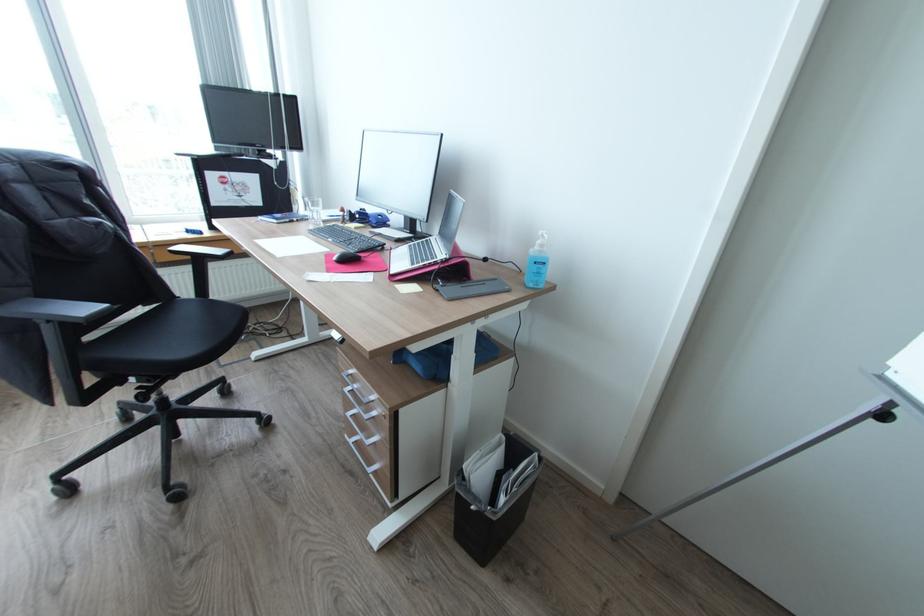
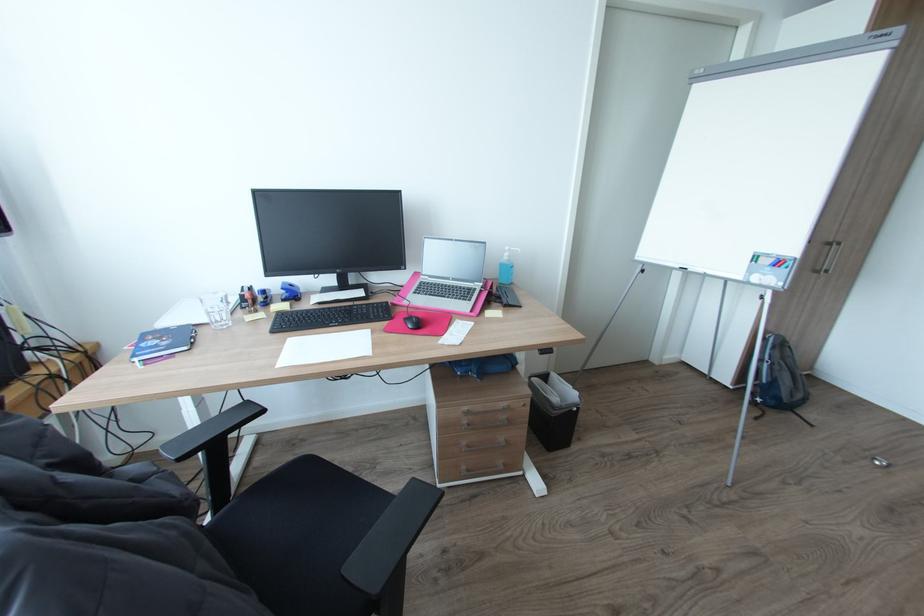
Where in the second image is the point corresponding to point 339,257 from the first image?

(417, 326)